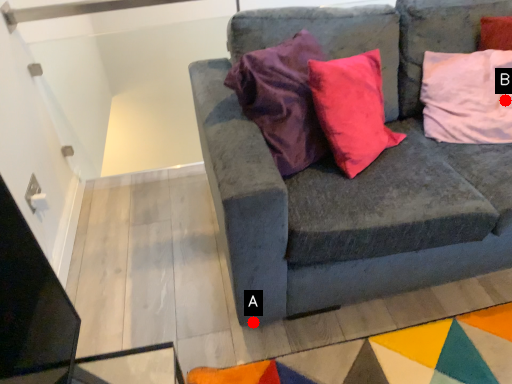
Question: Two points are circled on the image, labeled by A and B beside each circle. Which point appears farthest from the camera in this image?

Choices:
 (A) A is further
 (B) B is further

Answer: (B)